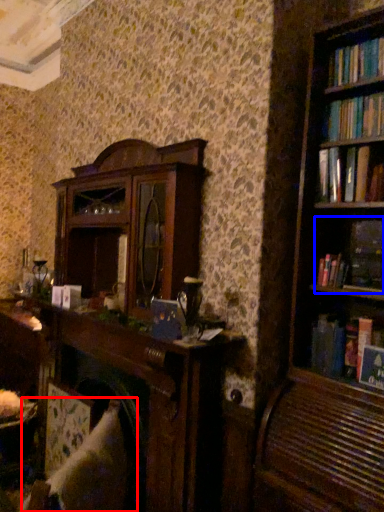
Question: Which object is further to the camera taking this photo, swivel chair (highlighted by a red box) or book (highlighted by a blue box)?

Choices:
 (A) swivel chair
 (B) book

Answer: (B)